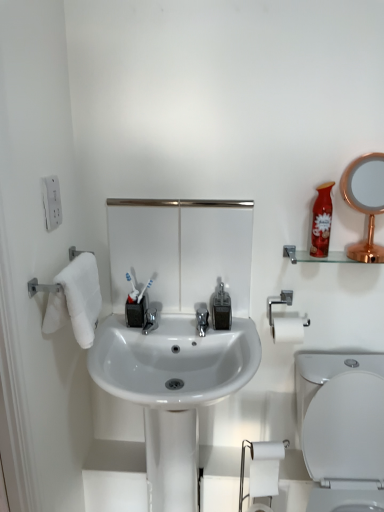
Where is `shiny red plastic mouthwash at upper right`? Image resolution: width=384 pixels, height=512 pixels. shiny red plastic mouthwash at upper right is located at coordinates (321, 221).

Where is `white glossy sink at center`? Image resolution: width=384 pixels, height=512 pixels. white glossy sink at center is located at coordinates (173, 390).

What do you see at coordinates (173, 390) in the screenshot? The height and width of the screenshot is (512, 384). I see `white glossy sink at center` at bounding box center [173, 390].

Image resolution: width=384 pixels, height=512 pixels. What do you see at coordinates (346, 443) in the screenshot?
I see `white glossy toilet at lower right` at bounding box center [346, 443].

You are a GUI agent. You are given a task and a screenshot of the screen. Output one action in this format:
    pyautogui.click(x=<x>, y=<y>)
    Task: Click on the rose gold metallic mirror at upper right
    
    Given the screenshot: What is the action you would take?
    pyautogui.click(x=365, y=201)

In order to face silver metallic towel bar at right, should I rotate leftwards or rightwards?

Turn right approximately 12.474 degrees to face it.

The width and height of the screenshot is (384, 512). Describe the element at coordinates (52, 202) in the screenshot. I see `white plastic outlet at upper left` at that location.

Locate an element on the screen. white matte toilet paper at lower right is located at coordinates pos(265,468).

Measure the distance from white glossy sink at center to silver metallic towel bar at right.

They are 15.85 inches apart.

Can you confirm if white glossy sink at center is positioned to the right of silver metallic towel bar at right?

No, white glossy sink at center is not to the right of silver metallic towel bar at right.

Is white glossy sink at center taller or shorter than silver metallic towel bar at right?

white glossy sink at center is taller than silver metallic towel bar at right.

Consider the image. Is white glossy sink at center not near silver metallic towel bar at right?

No, white glossy sink at center is not far away from silver metallic towel bar at right.

Looking at this image, are white plastic outlet at upper left and shiny red plastic mouthwash at upper right making contact?

There is a gap between white plastic outlet at upper left and shiny red plastic mouthwash at upper right.

Is white plastic outlet at upper left located outside shiny red plastic mouthwash at upper right?

white plastic outlet at upper left lies outside shiny red plastic mouthwash at upper right's area.

How many degrees apart are the facing directions of white plastic outlet at upper left and shiny red plastic mouthwash at upper right?

The facing directions of white plastic outlet at upper left and shiny red plastic mouthwash at upper right are 90 degrees apart.

From the image's perspective, which one is positioned higher, white plastic outlet at upper left or shiny red plastic mouthwash at upper right?

white plastic outlet at upper left.

Is white glossy toilet at lower right not inside white matte toilet paper at lower right?

Yes, white glossy toilet at lower right is located beyond the bounds of white matte toilet paper at lower right.

Which object is wider, white glossy toilet at lower right or white matte toilet paper at lower right?

With larger width is white glossy toilet at lower right.

The width and height of the screenshot is (384, 512). I want to click on toilet paper above the white glossy toilet at lower right (from a real-world perspective), so click(265, 468).

From the image's perspective, who appears lower, white glossy toilet at lower right or white matte toilet paper at lower right?

white glossy toilet at lower right appears lower in the image.

From a real-world perspective, does silver metallic towel bar at right sit lower than clear glass shelf at upper right?

Yes.

Is silver metallic towel bar at right positioned with its back to clear glass shelf at upper right?

No, silver metallic towel bar at right is not facing the opposite direction of clear glass shelf at upper right.

Is silver metallic towel bar at right closer to the viewer compared to clear glass shelf at upper right?

No, silver metallic towel bar at right is behind clear glass shelf at upper right.

Is silver metallic towel bar at right directly adjacent to clear glass shelf at upper right?

There is a gap between silver metallic towel bar at right and clear glass shelf at upper right.

Considering the points (290, 259) and (158, 448), which point is in front, point (290, 259) or point (158, 448)?

Positioned in front is point (158, 448).

Does clear glass shelf at upper right turn towards white glossy sink at center?

No.

Are clear glass shelf at upper right and white glossy sink at center beside each other?

There is a gap between clear glass shelf at upper right and white glossy sink at center.

Which is behind, clear glass shelf at upper right or white glossy sink at center?

clear glass shelf at upper right.

Is translucent plastic soap dispenser at center aimed at rose gold metallic mirror at upper right?

No, translucent plastic soap dispenser at center is not aimed at rose gold metallic mirror at upper right.

Is point (211, 305) less distant than point (363, 204)?

No, it is not.

Considering the sizes of objects translucent plastic soap dispenser at center and rose gold metallic mirror at upper right in the image provided, who is taller, translucent plastic soap dispenser at center or rose gold metallic mirror at upper right?

rose gold metallic mirror at upper right is taller.

Considering the relative positions of translucent plastic soap dispenser at center and rose gold metallic mirror at upper right in the image provided, is translucent plastic soap dispenser at center to the left or to the right of rose gold metallic mirror at upper right?

Based on their positions, translucent plastic soap dispenser at center is located to the left of rose gold metallic mirror at upper right.

Which is in front, clear glass shelf at upper right or silver metallic towel bar at right?

clear glass shelf at upper right is more forward.

In the scene shown: Is clear glass shelf at upper right beside silver metallic towel bar at right?

No, clear glass shelf at upper right is not with silver metallic towel bar at right.

Which is correct: clear glass shelf at upper right is inside silver metallic towel bar at right, or outside of it?

clear glass shelf at upper right is not enclosed by silver metallic towel bar at right.

Looking at this image, is clear glass shelf at upper right thinner than silver metallic towel bar at right?

Indeed, clear glass shelf at upper right has a lesser width compared to silver metallic towel bar at right.

In the image, there is a white glossy sink at center. At what (x,y) coordinates should I click in order to perform the action: click on towel bar above it (from the image's perspective). Please return your answer as a coordinate pair (x, y). Looking at the image, I should click on (286, 320).

What are the coordinates of `electric outlet in front of the shiny red plastic mouthwash at upper right` in the screenshot? It's located at (52, 202).

Considering their positions, is translucent plastic soap dispenser at center positioned closer to silver metallic towel bar at right than shiny red plastic mouthwash at upper right?

Among the two, translucent plastic soap dispenser at center is located nearer to silver metallic towel bar at right.

Considering their positions, is white glossy toilet at lower right positioned closer to white glossy sink at center than silver metallic towel bar at right?

Based on the image, silver metallic towel bar at right appears to be nearer to white glossy sink at center.

Estimate the real-world distances between objects in this image. Which object is further from translucent plastic soap dispenser at center, clear glass shelf at upper right or rose gold metallic mirror at upper right?

rose gold metallic mirror at upper right.

Considering their positions, is translucent plastic soap dispenser at center positioned further to clear glass shelf at upper right than white glossy sink at center?

Among the two, white glossy sink at center is located further to clear glass shelf at upper right.

Based on the photo, estimate the real-world distances between objects in this image. Which object is closer to silver metallic towel bar at right, translucent plastic soap dispenser at center or white plastic outlet at upper left?

translucent plastic soap dispenser at center is positioned closer to the anchor silver metallic towel bar at right.

Considering their positions, is rose gold metallic mirror at upper right positioned further to translucent plastic soap dispenser at center than shiny red plastic mouthwash at upper right?

Based on the image, rose gold metallic mirror at upper right appears to be further to translucent plastic soap dispenser at center.

Considering their positions, is translucent plastic soap dispenser at center positioned closer to white matte toilet paper at lower right than clear glass shelf at upper right?

translucent plastic soap dispenser at center lies closer to white matte toilet paper at lower right than the other object.

Considering their positions, is silver metallic towel bar at right positioned closer to white matte toilet paper at lower right than white glossy sink at center?

Based on the image, white glossy sink at center appears to be nearer to white matte toilet paper at lower right.

Where is `mouthwash that lies between white plastic outlet at upper left and white glossy sink at center from top to bottom`? This screenshot has height=512, width=384. mouthwash that lies between white plastic outlet at upper left and white glossy sink at center from top to bottom is located at coordinates (321, 221).

At what (x,y) coordinates should I click in order to perform the action: click on soap dispenser that lies between shiny red plastic mouthwash at upper right and silver metallic towel bar at right from top to bottom. Please return your answer as a coordinate pair (x, y). The width and height of the screenshot is (384, 512). Looking at the image, I should click on (221, 309).

You are a GUI agent. You are given a task and a screenshot of the screen. Output one action in this format:
    pyautogui.click(x=<x>, y=<y>)
    Task: Click on the toilet paper between silver metallic towel bar at right and white glossy toilet at lower right in the vertical direction
    
    Given the screenshot: What is the action you would take?
    pyautogui.click(x=265, y=468)

Locate an element on the screen. mouthwash between translucent plastic soap dispenser at center and rose gold metallic mirror at upper right in the horizontal direction is located at coordinates point(321,221).